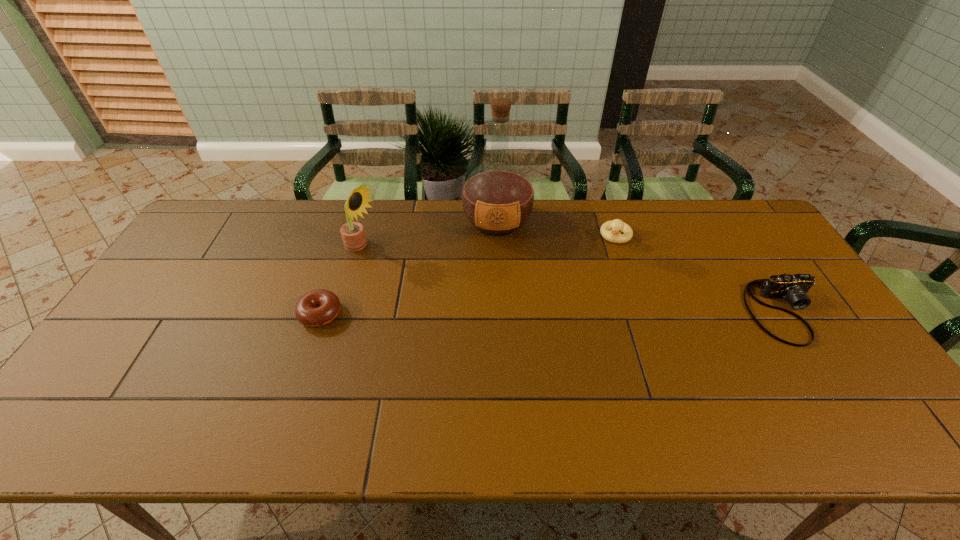
The image size is (960, 540). In order to click on doughnut in this screenshot , I will do coord(318,307).

You are a GUI agent. You are given a task and a screenshot of the screen. Output one action in this format:
    pyautogui.click(x=<x>, y=<y>)
    Task: Click on the fourth tallest object
    
    Given the screenshot: What is the action you would take?
    pyautogui.click(x=793, y=288)

Find the location of a particular element. This screenshot has width=960, height=540. camera is located at coordinates (793, 288).

Find the location of a particular element. duckling is located at coordinates (616, 226).

Image resolution: width=960 pixels, height=540 pixels. In order to click on the tallest object in this screenshot , I will do `click(497, 198)`.

The width and height of the screenshot is (960, 540). I want to click on liquor, so click(497, 198).

At what (x,y) coordinates should I click in order to perform the action: click on the fourth shortest object. Please return your answer as a coordinate pair (x, y). This screenshot has height=540, width=960. Looking at the image, I should click on (352, 233).

This screenshot has height=540, width=960. What are the coordinates of `vacant position located 0.200m on the back of the shortest object` in the screenshot? It's located at (341, 252).

In order to click on vacant area located 0.160m on the front-facing side of the rightmost object in this screenshot , I will do `click(841, 403)`.

The image size is (960, 540). What are the coordinates of `vacant area situated 0.260m at the beak of the duckling` in the screenshot? It's located at (588, 299).